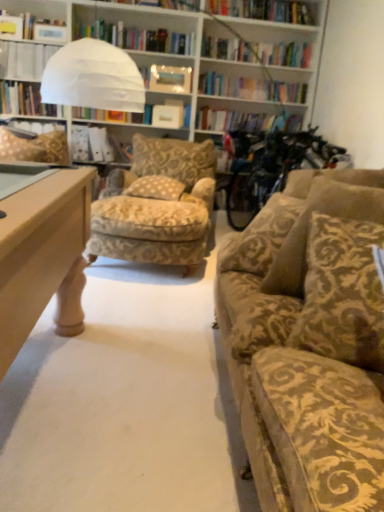
This screenshot has width=384, height=512. I want to click on free point in front of gold-patterned fabric chair at center, so click(140, 308).